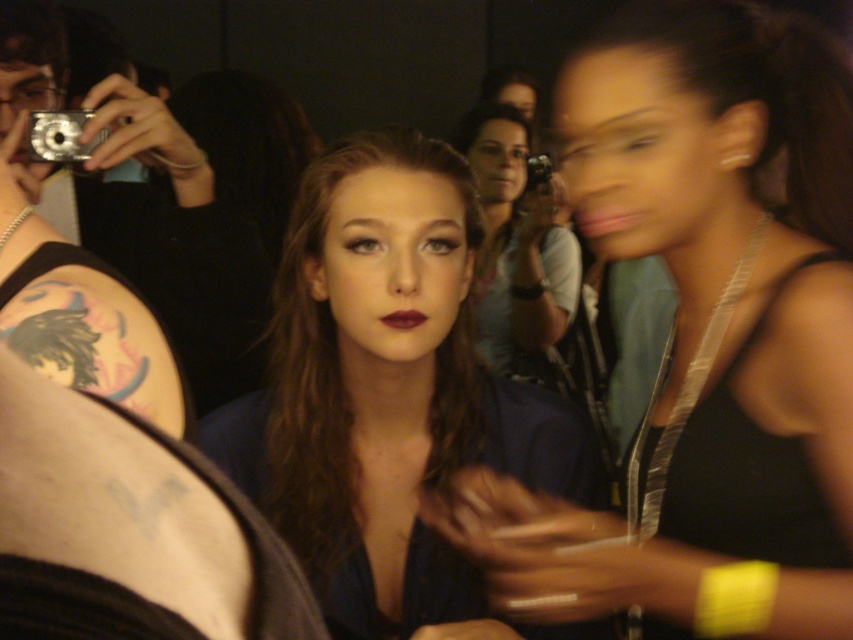
Question: Can you confirm if black satin dress at right is positioned to the left of matte blue dress at center?

Choices:
 (A) yes
 (B) no

Answer: (B)

Question: Is black satin dress at right behind silver metallic camera at center?

Choices:
 (A) no
 (B) yes

Answer: (A)

Question: Which object is closer to the camera taking this photo?

Choices:
 (A) black satin dress at right
 (B) silver metallic camera at upper left

Answer: (A)

Question: Can you confirm if matte black camera at center is wider than silver metallic camera at center?

Choices:
 (A) yes
 (B) no

Answer: (A)

Question: Which object is positioned closest to the matte black camera at center?

Choices:
 (A) black satin dress at right
 (B) silver metallic camera at center

Answer: (B)

Question: Which point is farther to the camera?

Choices:
 (A) matte black camera at center
 (B) silver metallic camera at center

Answer: (B)